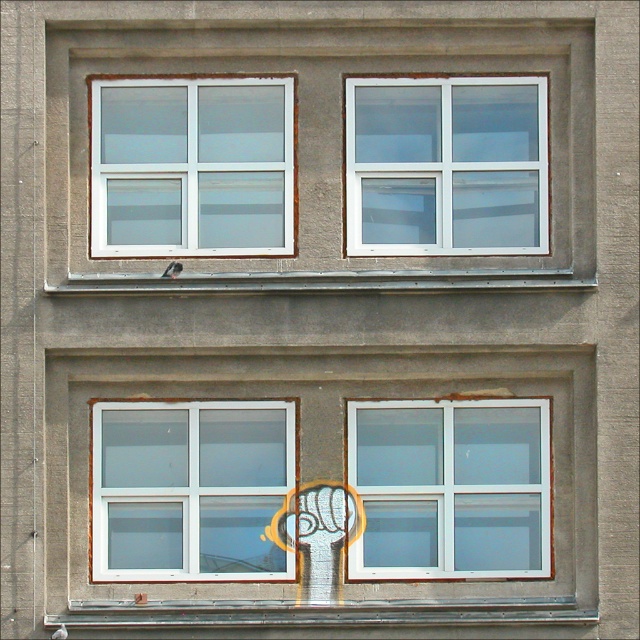
The height and width of the screenshot is (640, 640). Identify the location of white plastic window at upper right. (445, 164).

Can you confirm if white plastic window at upper right is positioned below white glass window at lower center?

Actually, white plastic window at upper right is above white glass window at lower center.

What do you see at coordinates (445, 164) in the screenshot? I see `white plastic window at upper right` at bounding box center [445, 164].

Where is `white plastic window at upper right`? Image resolution: width=640 pixels, height=640 pixels. white plastic window at upper right is located at coordinates (445, 164).

Measure the distance from white glass window at lower center to white glass window at lower left.

A distance of 37.33 inches exists between white glass window at lower center and white glass window at lower left.

From the picture: Does white glass window at lower center have a larger size compared to white glass window at lower left?

Yes.

Between point (547, 486) and point (230, 509), which one is positioned behind?

The point (230, 509) is behind.

Locate an element on the screen. The height and width of the screenshot is (640, 640). white glass window at lower center is located at coordinates (449, 486).

The width and height of the screenshot is (640, 640). I want to click on white plastic window at upper right, so click(x=445, y=164).

Does white plastic window at upper right appear on the right side of white plastic window at upper left?

Indeed, white plastic window at upper right is positioned on the right side of white plastic window at upper left.

Does point (461, 184) come in front of point (284, 224)?

No, (461, 184) is behind (284, 224).

You are a GUI agent. You are given a task and a screenshot of the screen. Output one action in this format:
    pyautogui.click(x=<x>, y=<y>)
    Task: Click on the white plastic window at upper right
    The image size is (640, 640).
    Given the screenshot: What is the action you would take?
    pyautogui.click(x=445, y=164)